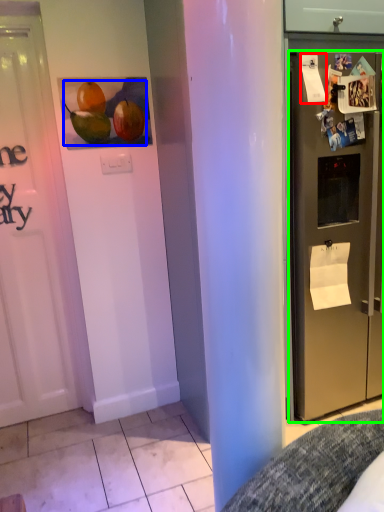
Question: Considering the real-world distances, which object is closest to paper (highlighted by a red box)? fruit (highlighted by a blue box) or refrigerator (highlighted by a green box).

Choices:
 (A) fruit
 (B) refrigerator

Answer: (B)